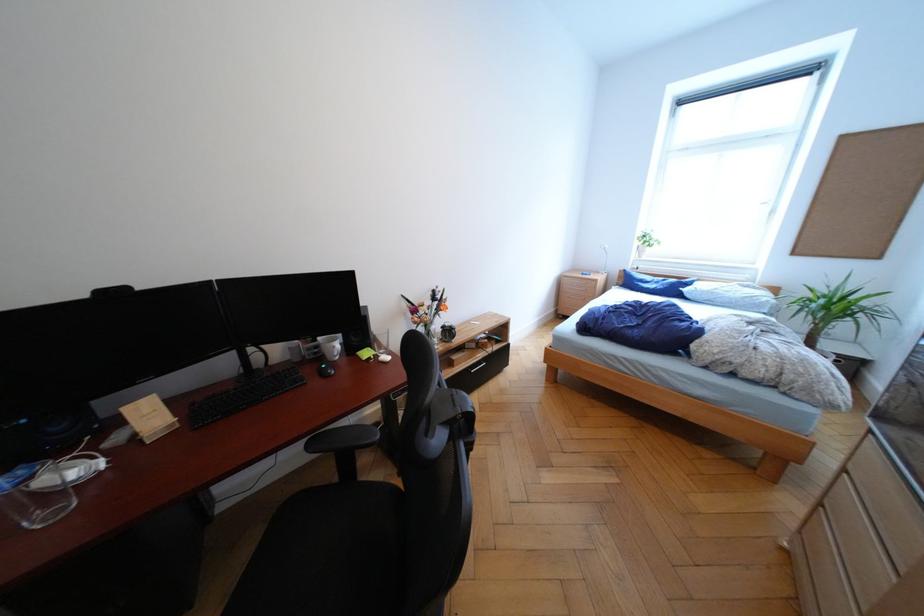
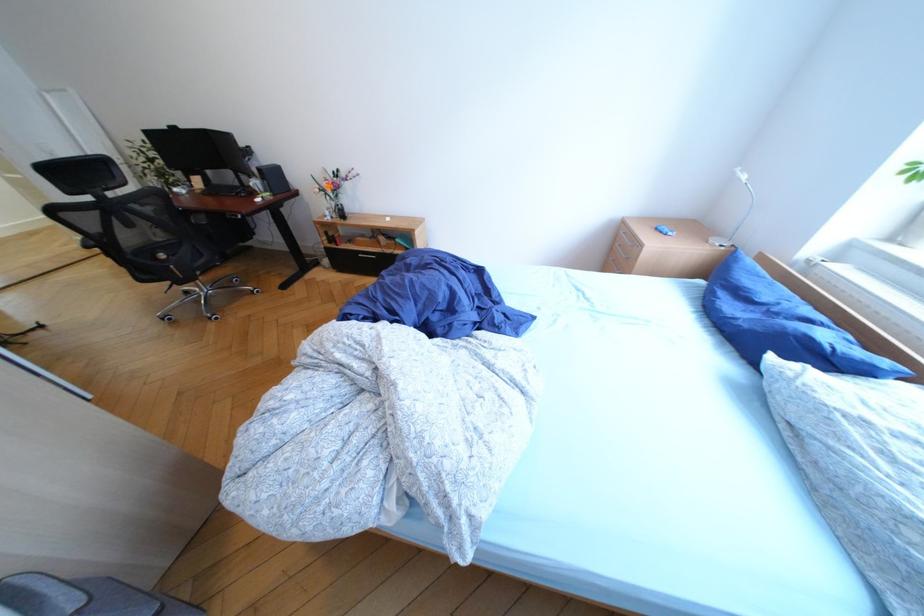
The point at (675, 286) is marked in the first image. Where is the corresponding point in the second image?

(768, 330)